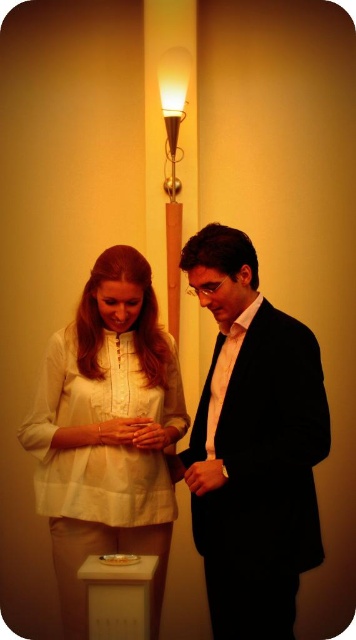
Does point (263, 385) come closer to viewer compared to point (169, 195)?

That is True.

Image resolution: width=356 pixels, height=640 pixels. Describe the element at coordinates (253, 444) in the screenshot. I see `black satin suit at center` at that location.

Who is more forward, (255, 444) or (175, 150)?

Positioned in front is point (255, 444).

Where is `black satin suit at center`? Image resolution: width=356 pixels, height=640 pixels. black satin suit at center is located at coordinates (253, 444).

Based on the photo, can you confirm if matte white blouse at center is smaller than matte gold lamp at upper center?

Actually, matte white blouse at center might be larger than matte gold lamp at upper center.

Who is positioned more to the left, matte white blouse at center or matte gold lamp at upper center?

From the viewer's perspective, matte white blouse at center appears more on the left side.

Which is behind, point (75, 580) or point (170, 195)?

The point (170, 195) is more distant.

This screenshot has width=356, height=640. I want to click on matte white blouse at center, so click(x=107, y=429).

Does point (210, 385) lie behind point (75, 445)?

Yes.

Does black satin suit at center lie in front of matte white blouse at center?

That is True.

Find the location of a particular element. This screenshot has width=356, height=640. black satin suit at center is located at coordinates (253, 444).

You are a GUI agent. You are given a task and a screenshot of the screen. Output one action in this format:
    pyautogui.click(x=<x>, y=<y>)
    Task: Click on the black satin suit at center
    The height and width of the screenshot is (640, 356).
    Given the screenshot: What is the action you would take?
    pyautogui.click(x=253, y=444)